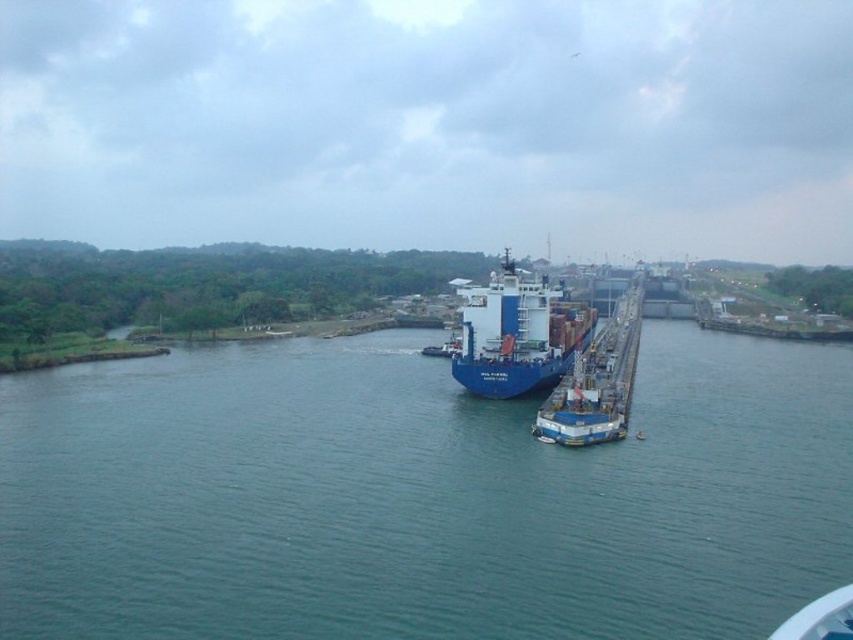
Who is positioned more to the left, blue metallic water at center or blue matte container ship at center?

Positioned to the left is blue metallic water at center.

Describe the element at coordinates (419, 497) in the screenshot. I see `blue metallic water at center` at that location.

Who is more forward, (199, 497) or (532, 301)?

Point (199, 497) is more forward.

You are a GUI agent. You are given a task and a screenshot of the screen. Output one action in this format:
    pyautogui.click(x=<x>, y=<y>)
    Task: Click on the blue metallic water at center
    This screenshot has height=640, width=853.
    Given the screenshot: What is the action you would take?
    pyautogui.click(x=419, y=497)